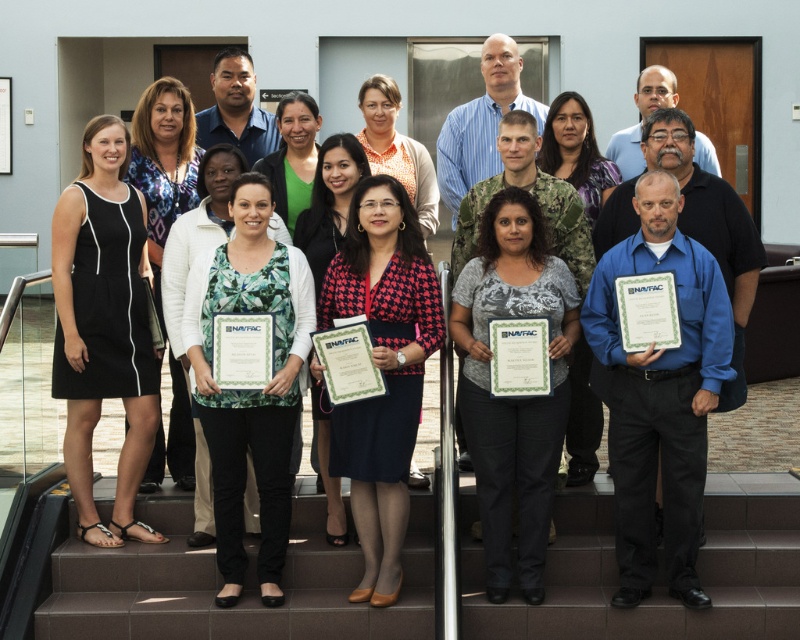
You are a photographer standing in front of the scene. You want to capture a photo of the houndstooth fabric blazer at center without including the brown tile stairs at lower center in the frame. Is it possible to do so by adjusting your camera angle upwards?

Yes, since the brown tile stairs at lower center is below the houndstought fabric blazer at center, adjusting the camera angle upwards would allow the photographer to focus on the houndstought fabric blazer at center while excluding the stairs.

You are standing in the same room as the group in the photo. You need to move from the brown tile stairs at lower center to the gray matte shirt at center. In which direction should you move to get there?

The brown tile stairs at lower center is to the left of gray matte shirt at center, so you should move to the right to reach the gray matte shirt at center from the stairs.

You are standing in front of the group photo and want to determine the relative positions of two points marked in the image. Which point is closer to you, point (654, 182) or point (404, 436)?

Point (654, 182) is closer to the viewer than point (404, 436).